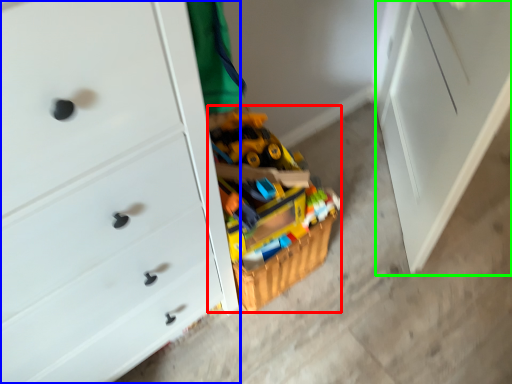
Question: Considering the real-world distances, which object is farthest from toy (highlighted by a red box)? chest of drawers (highlighted by a blue box) or file cabinet (highlighted by a green box)?

Choices:
 (A) chest of drawers
 (B) file cabinet

Answer: (B)